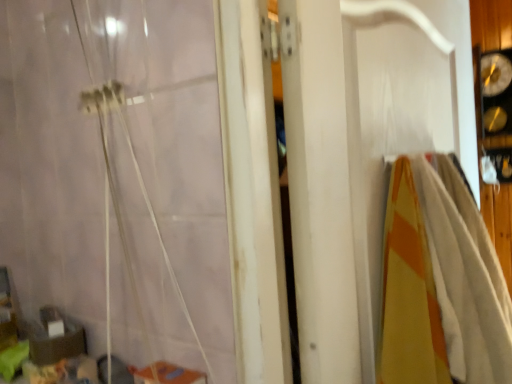
Where is `yellow fabric at right`? yellow fabric at right is located at coordinates (466, 281).

Measure the distance between yellow fabric at right and camera.

The depth of yellow fabric at right is 28.11 inches.

The height and width of the screenshot is (384, 512). What do you see at coordinates (466, 281) in the screenshot?
I see `yellow fabric at right` at bounding box center [466, 281].

Where is `yellow fabric at right`? yellow fabric at right is located at coordinates (466, 281).